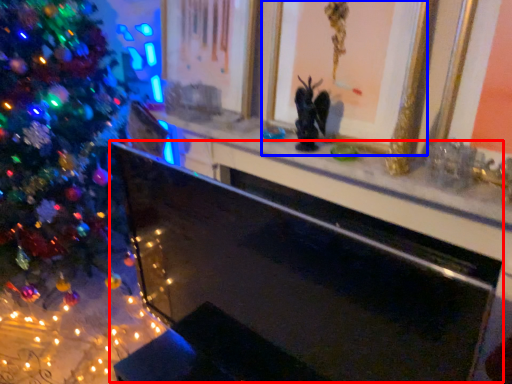
Question: Which object is closer to the camera taking this photo, fireplace (highlighted by a red box) or picture frame (highlighted by a blue box)?

Choices:
 (A) fireplace
 (B) picture frame

Answer: (A)